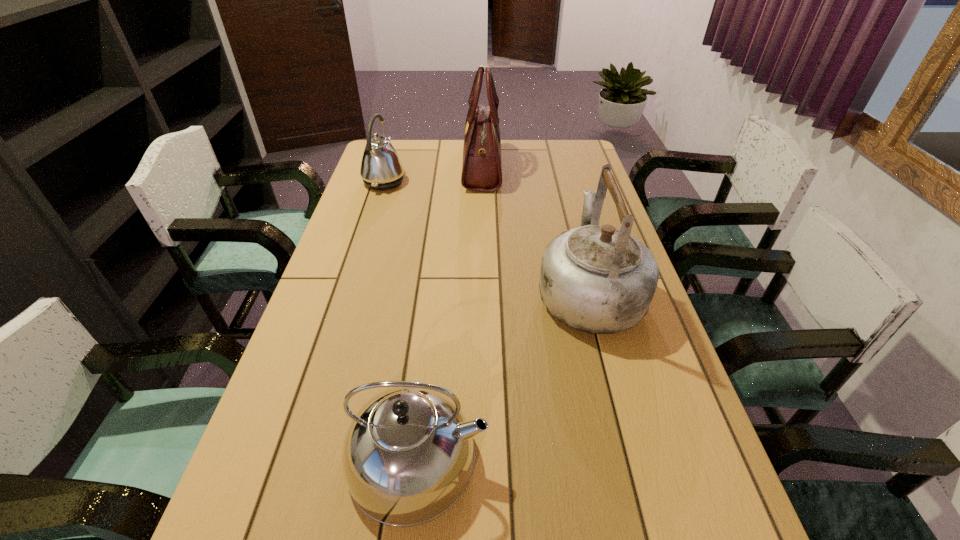
This screenshot has height=540, width=960. I want to click on handbag, so click(x=481, y=171).

Where is `the rightmost object`? The image size is (960, 540). the rightmost object is located at coordinates (599, 279).

The image size is (960, 540). I want to click on the third farthest object, so (x=599, y=279).

Find the location of a particular element. This screenshot has width=960, height=540. the leftmost object is located at coordinates (381, 168).

Where is `the leftmost kettle`? the leftmost kettle is located at coordinates (381, 168).

Locate an element on the screen. the second kettle from left to right is located at coordinates (408, 456).

Where is `the nearest object`? The height and width of the screenshot is (540, 960). the nearest object is located at coordinates (408, 456).

At what (x,y) coordinates should I click in order to perform the action: click on blank area located 0.070m on the front-facing side of the handbag. Please return your answer as a coordinate pair (x, y). The height and width of the screenshot is (540, 960). Looking at the image, I should click on (444, 167).

The image size is (960, 540). What are the coordinates of `free space located on the front-facing side of the handbag` in the screenshot? It's located at (437, 167).

At what (x,y) coordinates should I click in order to perform the action: click on free space located 0.050m on the front-facing side of the handbag. Please return your answer as a coordinate pair (x, y). Looking at the image, I should click on (450, 167).